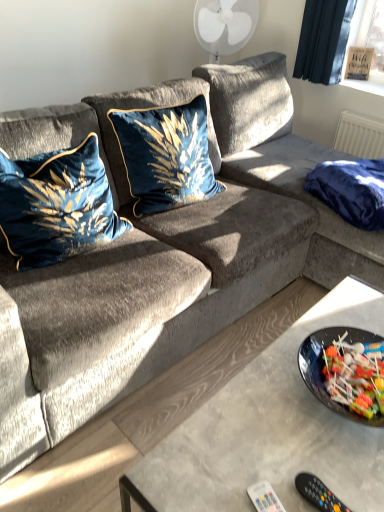
Question: Does point (59, 241) appear closer or farther from the camera than point (367, 179)?

Choices:
 (A) closer
 (B) farther

Answer: (A)

Question: From the image's perspective, is velvet blue pillow at left, placed as the first pillow when sorted from left to right, located above or below navy blue fabric at right?

Choices:
 (A) above
 (B) below

Answer: (B)

Question: Which is nearer to the white plastic remote at lower center?

Choices:
 (A) velvet blue pillow at center, the second pillow positioned from the left
 (B) black plastic remote control at lower right
 (C) navy blue fabric at right
 (D) velvet blue pillow at left, arranged as the second pillow when viewed from the right

Answer: (B)

Question: Estimate the real-world distances between objects in this image. Which object is closer to the black plastic remote control at lower right?

Choices:
 (A) navy blue fabric at right
 (B) velvet blue pillow at center, which ranks as the 1th pillow in right-to-left order
 (C) velvet blue pillow at left, placed as the first pillow when sorted from left to right
 (D) white plastic remote at lower center

Answer: (D)